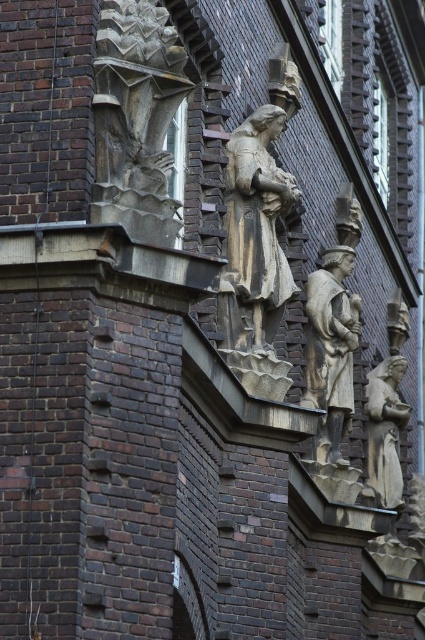
Question: Does rustic stone carving at upper left appear on the left side of polished bronze statue at center?

Choices:
 (A) no
 (B) yes

Answer: (B)

Question: Which object is the closest to the rustic stone carving at upper left?

Choices:
 (A) matte stone statue at lower right
 (B) stone statue at center
 (C) polished bronze statue at center

Answer: (B)

Question: Which point is closer to the camera?

Choices:
 (A) rustic stone carving at upper left
 (B) polished bronze statue at center
 (C) matte stone statue at lower right

Answer: (A)

Question: Among these objects, which one is nearest to the camera?

Choices:
 (A) rustic stone carving at upper left
 (B) matte stone statue at lower right
 (C) stone statue at center
 (D) polished bronze statue at center

Answer: (A)

Question: Is rustic stone carving at upper left thinner than stone statue at center?

Choices:
 (A) yes
 (B) no

Answer: (B)

Question: Is polished bronze statue at center thinner than matte stone statue at lower right?

Choices:
 (A) yes
 (B) no

Answer: (B)